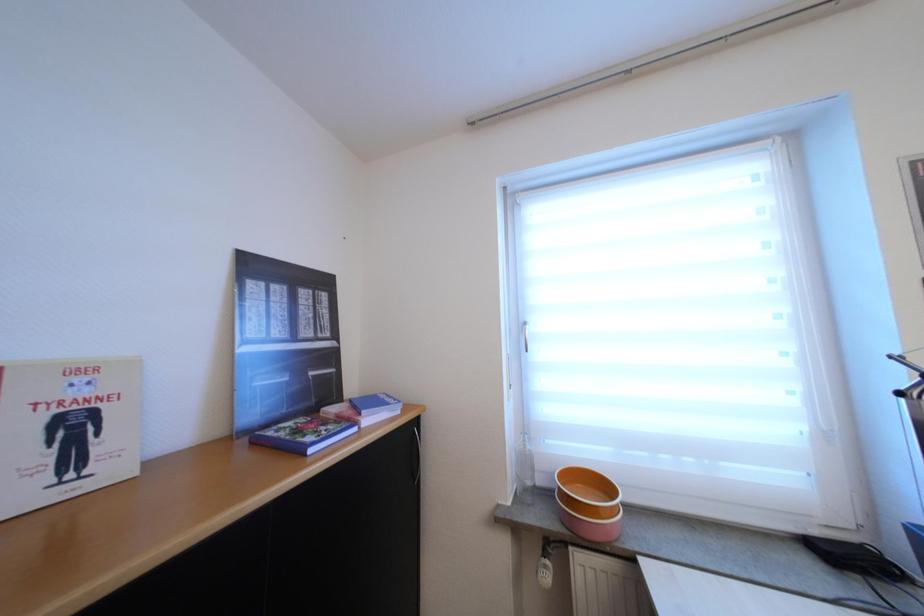
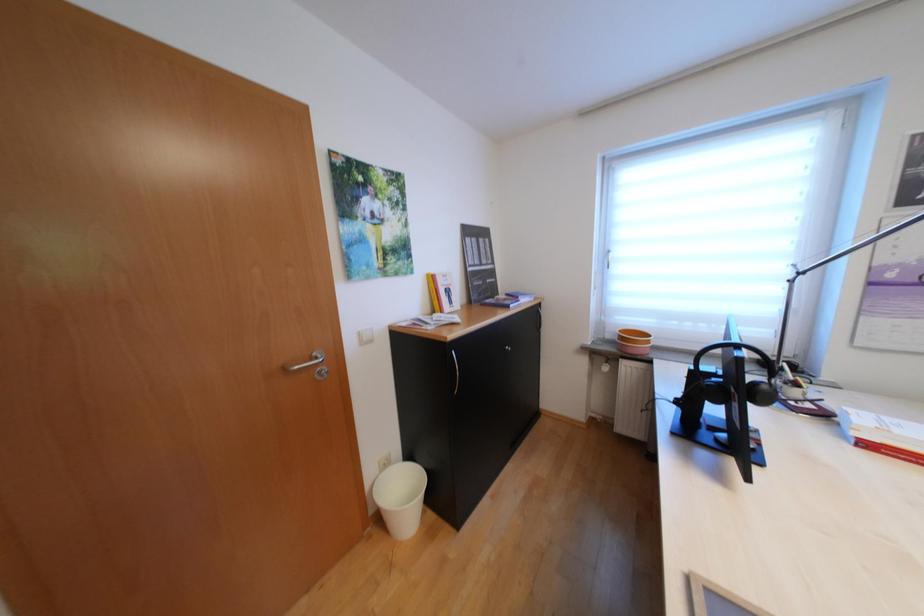
Question: Which direction would the cameraman need to move to produce the second image? Reply with the corresponding letter.

Choices:
 (A) Left
 (B) Right
 (C) Forward
 (D) Backward

Answer: (D)